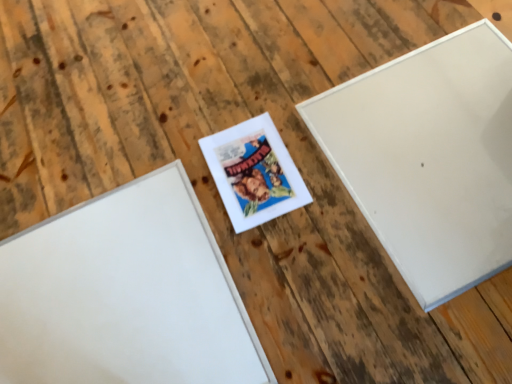
Question: From the image's perspective, is matte white picture frame at center, positioned as the second picture frame in right-to-left order, beneath white matte picture frame at center, positioned as the 3th picture frame in right-to-left order?

Choices:
 (A) yes
 (B) no

Answer: (B)

Question: Are matte white picture frame at center, the second picture frame from the left, and white matte picture frame at center, which appears as the 1th picture frame when viewed from the left, located far from each other?

Choices:
 (A) yes
 (B) no

Answer: (B)

Question: Considering the relative sizes of matte white picture frame at center, positioned as the second picture frame in right-to-left order, and white matte picture frame at center, which appears as the 1th picture frame when viewed from the left, in the image provided, is matte white picture frame at center, positioned as the second picture frame in right-to-left order, bigger than white matte picture frame at center, which appears as the 1th picture frame when viewed from the left,?

Choices:
 (A) no
 (B) yes

Answer: (A)

Question: Is white matte picture frame at center, positioned as the 3th picture frame in right-to-left order, at the back of matte white picture frame at center, the second picture frame from the left?

Choices:
 (A) no
 (B) yes

Answer: (A)

Question: Is matte white picture frame at center, positioned as the second picture frame in right-to-left order, facing towards white matte picture frame at center, which appears as the 1th picture frame when viewed from the left?

Choices:
 (A) no
 (B) yes

Answer: (A)

Question: Considering the positions of white matte picture frame at upper right, the first picture frame positioned from the right, and white matte picture frame at center, positioned as the 3th picture frame in right-to-left order, in the image, is white matte picture frame at upper right, the first picture frame positioned from the right, wider or thinner than white matte picture frame at center, positioned as the 3th picture frame in right-to-left order,?

Choices:
 (A) wide
 (B) thin

Answer: (A)

Question: Does point (493, 36) appear closer or farther from the camera than point (40, 354)?

Choices:
 (A) closer
 (B) farther

Answer: (B)

Question: Considering the positions of white matte picture frame at upper right, placed as the third picture frame when sorted from left to right, and white matte picture frame at center, which appears as the 1th picture frame when viewed from the left, in the image, is white matte picture frame at upper right, placed as the third picture frame when sorted from left to right, taller or shorter than white matte picture frame at center, which appears as the 1th picture frame when viewed from the left,?

Choices:
 (A) short
 (B) tall

Answer: (B)

Question: In the image, is white matte picture frame at upper right, placed as the third picture frame when sorted from left to right, positioned in front of or behind white matte picture frame at center, which appears as the 1th picture frame when viewed from the left?

Choices:
 (A) behind
 (B) front

Answer: (A)

Question: In terms of height, does matte white picture frame at center, positioned as the second picture frame in right-to-left order, look taller or shorter compared to white matte picture frame at center, positioned as the 3th picture frame in right-to-left order?

Choices:
 (A) short
 (B) tall

Answer: (A)

Question: Is matte white picture frame at center, positioned as the second picture frame in right-to-left order, bigger or smaller than white matte picture frame at center, which appears as the 1th picture frame when viewed from the left?

Choices:
 (A) small
 (B) big

Answer: (A)

Question: Is matte white picture frame at center, positioned as the second picture frame in right-to-left order, situated inside white matte picture frame at center, positioned as the 3th picture frame in right-to-left order, or outside?

Choices:
 (A) inside
 (B) outside

Answer: (B)

Question: From a real-world perspective, is matte white picture frame at center, the second picture frame from the left, physically located above or below white matte picture frame at center, which appears as the 1th picture frame when viewed from the left?

Choices:
 (A) above
 (B) below

Answer: (B)

Question: Is white matte picture frame at center, which appears as the 1th picture frame when viewed from the left, spatially inside white matte picture frame at upper right, placed as the third picture frame when sorted from left to right, or outside of it?

Choices:
 (A) outside
 (B) inside

Answer: (A)

Question: Based on their positions, is white matte picture frame at center, which appears as the 1th picture frame when viewed from the left, located to the left or right of white matte picture frame at upper right, the first picture frame positioned from the right?

Choices:
 (A) right
 (B) left

Answer: (B)